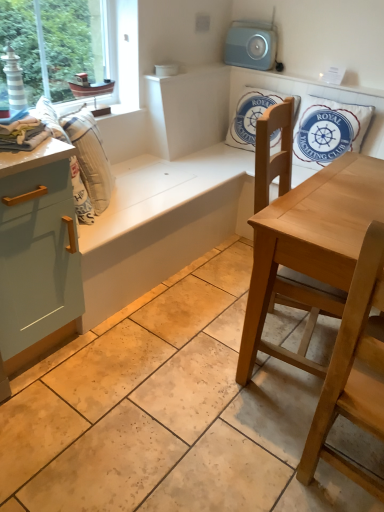
Where is `vacant space underneath light wood chair at lower right, marked as the 1th chair in a front-to-back arrangement (from a real-world perspective)`? This screenshot has width=384, height=512. vacant space underneath light wood chair at lower right, marked as the 1th chair in a front-to-back arrangement (from a real-world perspective) is located at coordinates point(338,484).